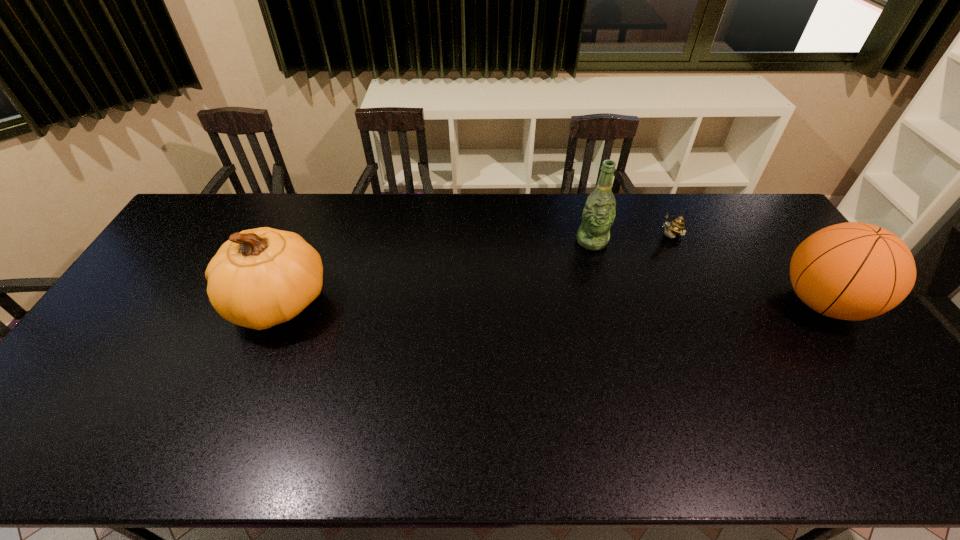
The image size is (960, 540). Find the location of `vacant space at the left edge`. vacant space at the left edge is located at coordinates (171, 317).

This screenshot has width=960, height=540. I want to click on vacant area at the far left corner of the desktop, so click(226, 226).

Where is `unoccupied area between the third object from right to left and the pumpkin`? This screenshot has width=960, height=540. unoccupied area between the third object from right to left and the pumpkin is located at coordinates (436, 272).

Image resolution: width=960 pixels, height=540 pixels. What are the coordinates of `blank region between the third object from left to right and the third object from right to left` in the screenshot? It's located at (631, 239).

Identify the location of free point between the second object from right to left and the rightmost object. (746, 270).

You are a GUI agent. You are given a task and a screenshot of the screen. Output one action in this format:
    pyautogui.click(x=<x>, y=<y>)
    Task: Click on the free area in between the snail and the pumpkin
    Image resolution: width=960 pixels, height=540 pixels.
    Given the screenshot: What is the action you would take?
    pyautogui.click(x=474, y=270)

At what (x,y) coordinates should I click in order to perform the action: click on free space between the second object from left to right and the leftmost object. Please return your answer as a coordinate pair (x, y). Looking at the image, I should click on (436, 272).

What are the coordinates of `blank region between the beer bottle and the third object from left to right` in the screenshot? It's located at (631, 239).

This screenshot has width=960, height=540. I want to click on vacant region between the pumpkin and the beer bottle, so click(x=436, y=272).

You are a GUI agent. You are given a task and a screenshot of the screen. Output one action in this format:
    pyautogui.click(x=<x>, y=<y>)
    Task: Click on the free space between the pumpkin and the basketball
    
    Given the screenshot: What is the action you would take?
    pos(551,303)